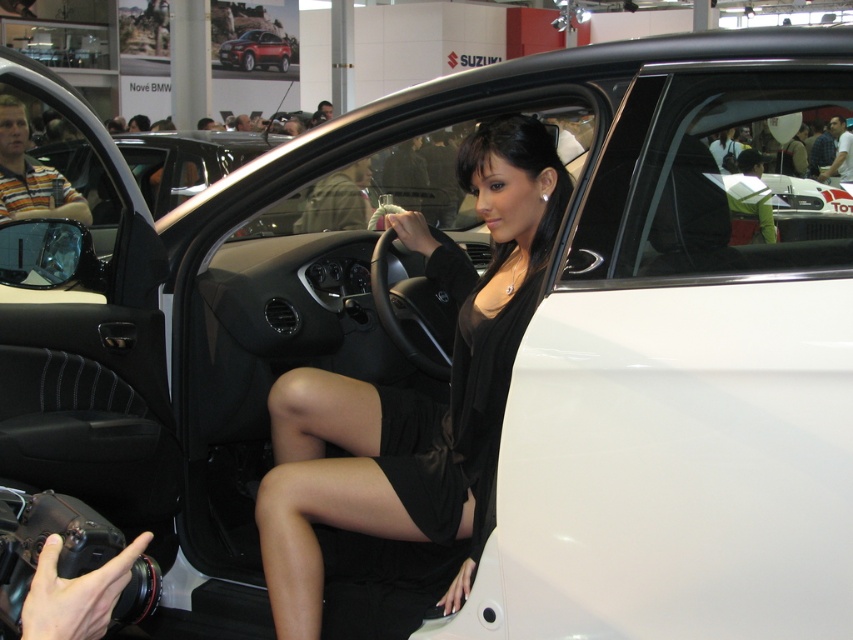
You are a photographer at an auto show. You need to decide whether the black satin dress at center will be fully visible in the photo compared to the metallic red suv at upper center. Based on their sizes, can you confirm if the dress will be fully visible?

The black satin dress at center is shorter than the metallic red suv at upper center, so the dress will be fully visible in the photo as it is not obscured by the SUV due to its smaller size.

You are a photographer at an auto show. You need to ensure that the black satin dress at center and the metallic red suv at upper center are both visible in your photo. Based on their sizes, which object will occupy more space in the frame?

The metallic red suv at upper center will occupy more space in the frame since it has a greater width than the black satin dress at center.

Looking at this image, you are a photographer at the auto show. You notice two dresses at the center of the scene. How far apart are the black matte dress at center and the black satin dress at center?

The black matte dress at center is 2.89 inches away from the black satin dress at center.